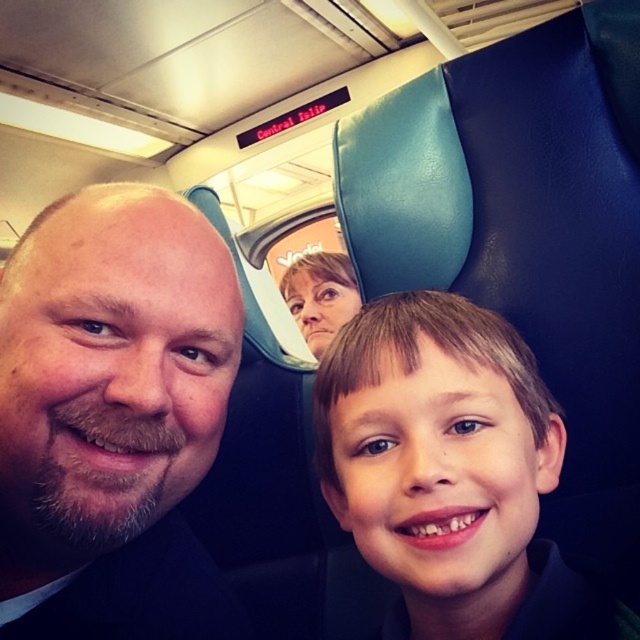
Question: Observing the image, what is the correct spatial positioning of brown beard at center in reference to matte skin face at center?

Choices:
 (A) above
 (B) below

Answer: (B)

Question: Considering the real-world distances, which object is closest to the brown beard at center?

Choices:
 (A) smooth skin face at center
 (B) matte skin face at center

Answer: (A)

Question: Is smooth skin face at center thinner than matte skin face at center?

Choices:
 (A) yes
 (B) no

Answer: (A)

Question: Which of the following is the closest to the observer?

Choices:
 (A) pyautogui.click(x=138, y=300)
 (B) pyautogui.click(x=321, y=301)
 (C) pyautogui.click(x=512, y=387)

Answer: (A)

Question: Can you confirm if brown beard at center is positioned below matte skin face at center?

Choices:
 (A) yes
 (B) no

Answer: (A)

Question: Considering the real-world distances, which object is closest to the brown beard at center?

Choices:
 (A) matte skin face at center
 (B) smooth skin face at center

Answer: (B)